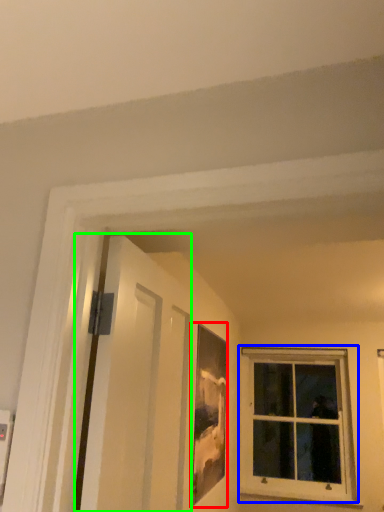
Question: Which object is positioned closest to picture frame (highlighted by a red box)? Select from window (highlighted by a blue box) and screen door (highlighted by a green box).

Choices:
 (A) window
 (B) screen door

Answer: (B)